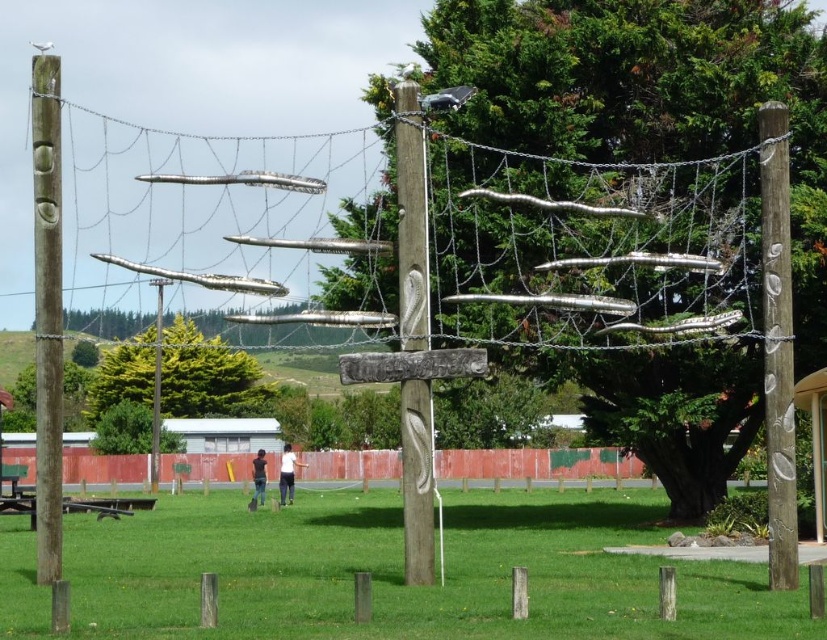
Question: Estimate the real-world distances between objects in this image. Which object is closer to the wooden post at right?

Choices:
 (A) wooden carving at center
 (B) white cotton shirt at center

Answer: (A)

Question: Among these objects, which one is nearest to the camera?

Choices:
 (A) green leafy tree at center
 (B) dark blue jeans at center

Answer: (B)

Question: Is green grass at center above dark blue jeans at center?

Choices:
 (A) no
 (B) yes

Answer: (B)

Question: Is green grass at center bigger than smooth wood post at left?

Choices:
 (A) no
 (B) yes

Answer: (A)

Question: Is green leafy tree at center bigger than dark blue jeans at center?

Choices:
 (A) yes
 (B) no

Answer: (A)

Question: Which point is closer to the camera?

Choices:
 (A) (182, 609)
 (B) (147, 356)
 (C) (281, 502)
 (D) (495, 8)

Answer: (A)